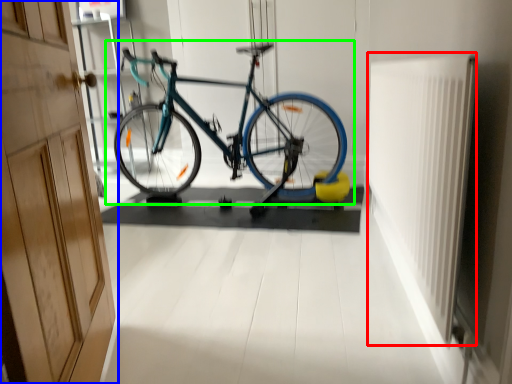
Question: Which is nearer to the radiator (highlighted by a red box)? door (highlighted by a blue box) or bicycle (highlighted by a green box).

Choices:
 (A) door
 (B) bicycle

Answer: (A)